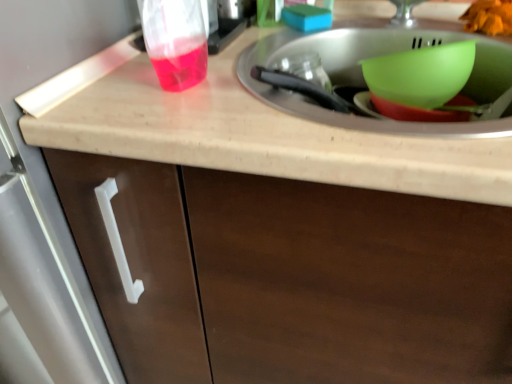
Find the location of a particular element. Image resolution: width=512 pixels, height=384 pixels. unoccupied area in front of transparent plastic cup at upper left is located at coordinates (152, 75).